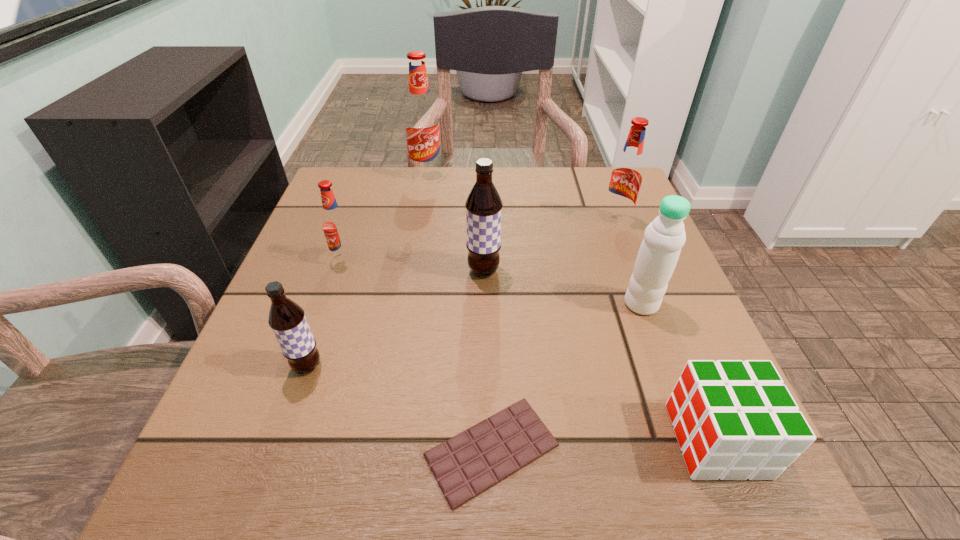
Locate an element on the screen. cube situated at the right edge is located at coordinates (733, 420).

Image resolution: width=960 pixels, height=540 pixels. Identify the location of object that is at the far right corner. (626, 176).

Locate an element on the screen. Image resolution: width=960 pixels, height=540 pixels. object located in the near right corner section of the desktop is located at coordinates (733, 420).

Locate an element on the screen. The image size is (960, 540). vacant space at the far edge of the desktop is located at coordinates (413, 178).

The width and height of the screenshot is (960, 540). In the image, there is a desktop. Identify the location of vacant space at the left edge. (332, 317).

Locate an element on the screen. free space at the right edge of the desktop is located at coordinates (640, 227).

Identify the location of vacant space at the far right corner. (604, 188).

The image size is (960, 540). In the image, there is a desktop. In order to click on free space at the near right corner in this screenshot , I will do `click(668, 455)`.

Where is `vacant area that lies between the bigger brown root beer and the shortest object`? Image resolution: width=960 pixels, height=540 pixels. vacant area that lies between the bigger brown root beer and the shortest object is located at coordinates (488, 360).

What are the coordinates of `free space that is in between the farthest root beer and the sixth farthest object` in the screenshot? It's located at (367, 271).